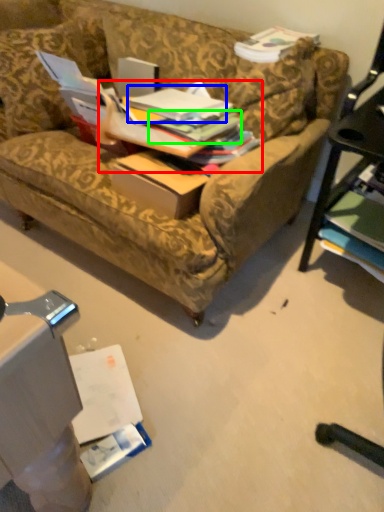
Question: Which is farther away from book (highlighted by a red box)? book (highlighted by a blue box) or book (highlighted by a green box)?

Choices:
 (A) book
 (B) book

Answer: (A)